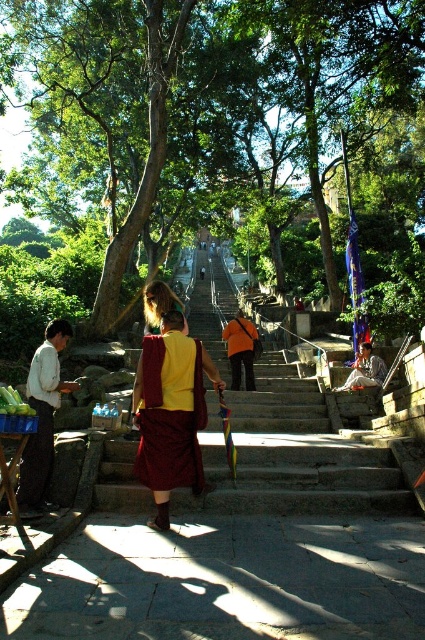
You are standing at the bottom left of the scene and want to walk towards the maroon silk robe at center. Which direction should you move in?

The maroon silk robe at center is located at point 0.652 on the x axis and 0.400 on the y axis. Since you are at the bottom left corner, you should move towards the upper right direction to reach the maroon silk robe at center.

You are a tourist standing at the bottom of the stone steps and want to take a photo of both the maroon silk robe at center and the orange fabric robe at center. Which robe should you focus on first to ensure both are in the frame?

You should focus on the maroon silk robe at center first since it is in front of the orange fabric robe at center, so adjusting the camera to include the maroon silk robe at center will naturally include the orange fabric robe at center behind it.